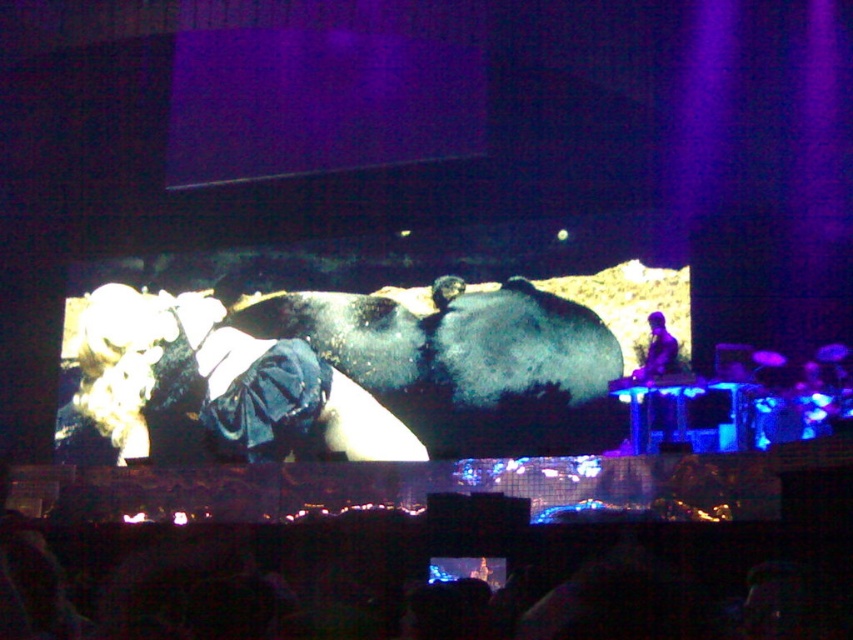
Consider the image. You are a photographer at the concert venue and want to capture both the point at coordinates point (235, 435) and point at coordinates point (660, 358) in a single frame. Given their positions, which point should you focus on first to ensure both are in the frame?

Since point (235, 435) is behind point (660, 358), you should focus on point (660, 358) first to ensure both points are visible in the frame.

From the picture: You are a stagehand who needs to move a 78 feet long banner from the shiny blue jacket at center to the dark blue fabric at right. Can you fit the banner between them without bending it?

The distance between the shiny blue jacket at center and the dark blue fabric at right is 77.83 feet, which is slightly shorter than the 78 feet long banner. Therefore, the banner cannot be placed straight between them without bending.